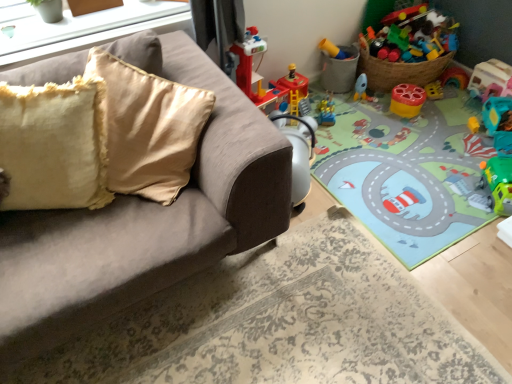
Where is `blank space situated above matte white window sill at upper left (from a real-world perspective)`? blank space situated above matte white window sill at upper left (from a real-world perspective) is located at coordinates (68, 21).